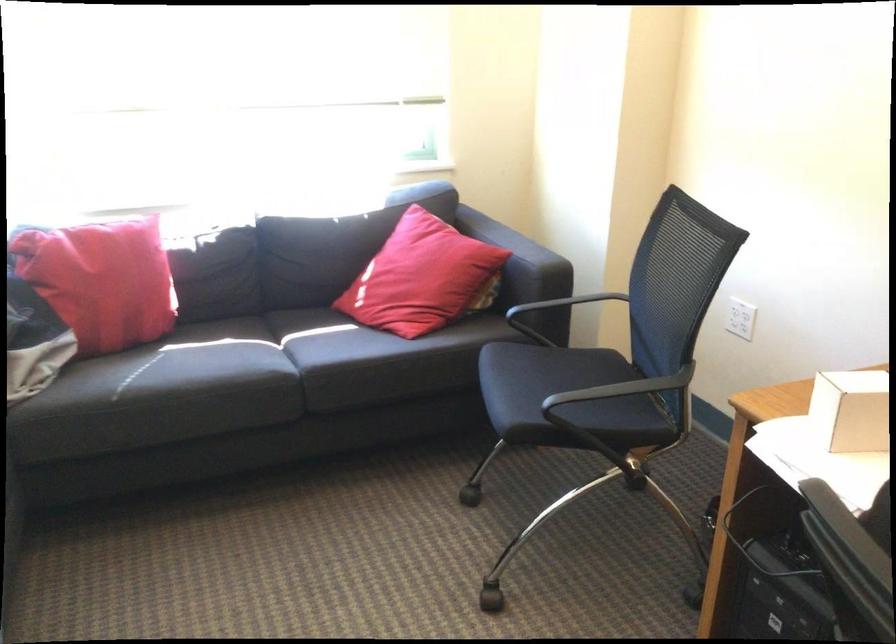
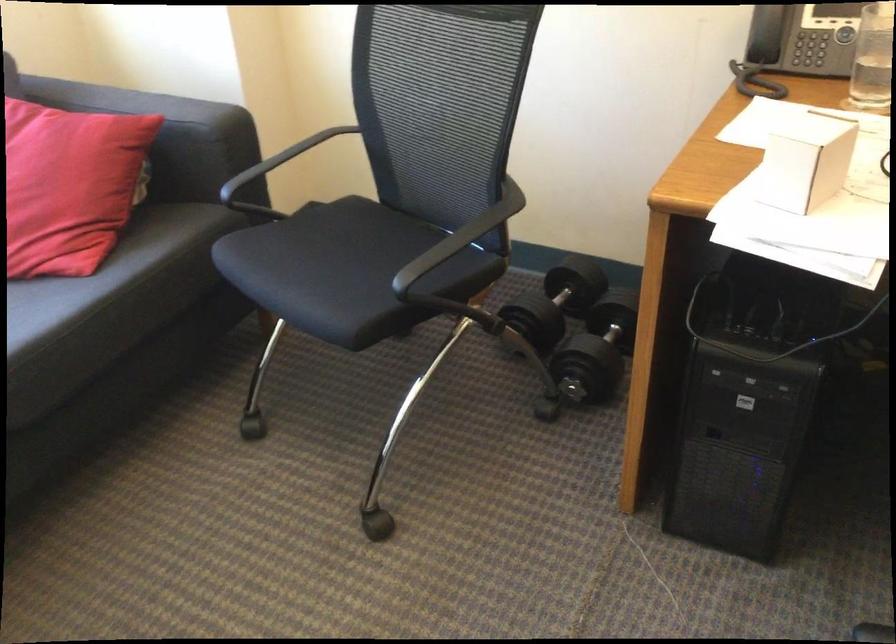
In the second image, find the point that corresponds to [470,324] in the first image.

(156, 230)